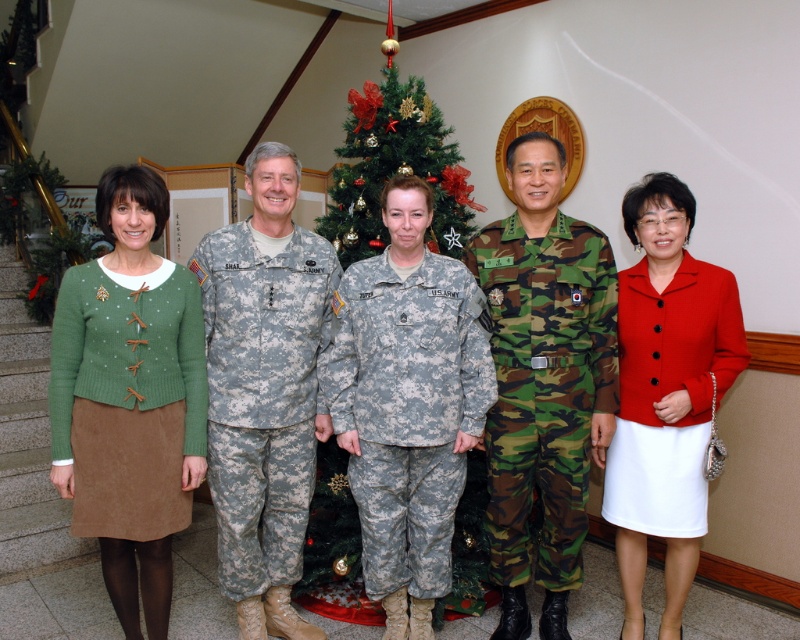
Locate an element on the screen. This screenshot has width=800, height=640. camo uniform at center is located at coordinates (544, 380).

Which is in front, point (578, 224) or point (204, 305)?

Point (204, 305) is more forward.

This screenshot has width=800, height=640. I want to click on camo uniform at center, so tap(544, 380).

Who is shorter, camouflage uniform at center or matte red blazer at right?

With less height is matte red blazer at right.

At what (x,y) coordinates should I click in order to perform the action: click on camouflage uniform at center. Please return your answer as a coordinate pair (x, y). The width and height of the screenshot is (800, 640). Looking at the image, I should click on (264, 390).

This screenshot has width=800, height=640. I want to click on camouflage uniform at center, so click(264, 390).

Can you confirm if green suede skirt at left is taller than camo uniform at center?

No, green suede skirt at left is not taller than camo uniform at center.

Locate an element on the screen. This screenshot has width=800, height=640. green suede skirt at left is located at coordinates (130, 400).

Where is `green suede skirt at left`? This screenshot has width=800, height=640. green suede skirt at left is located at coordinates (130, 400).